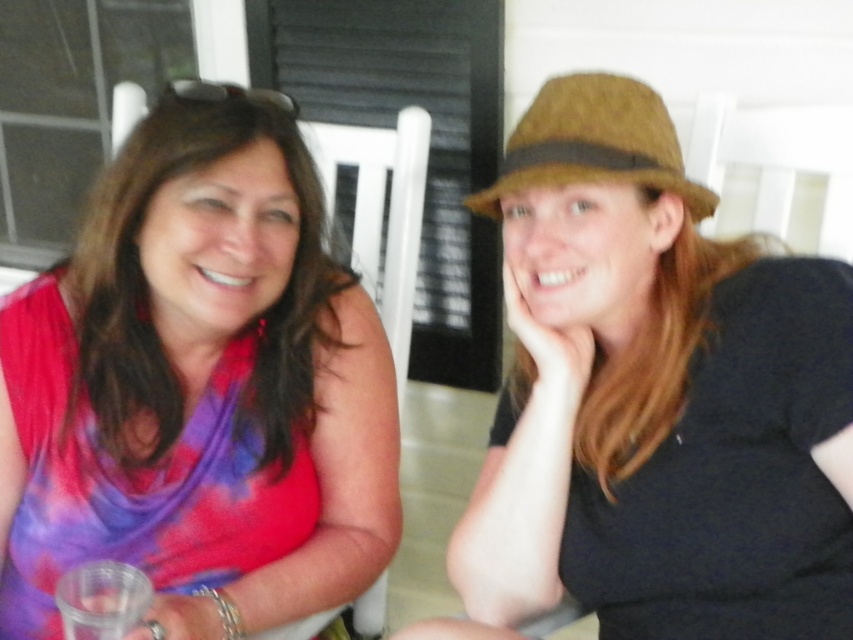
Question: Does matte tie-dye tank top at left have a lesser width compared to brown felt fedora at upper right?

Choices:
 (A) no
 (B) yes

Answer: (A)

Question: Does brown felt hat at upper right appear under brown felt fedora at upper right?

Choices:
 (A) yes
 (B) no

Answer: (A)

Question: Which is farther from the brown felt fedora at upper right?

Choices:
 (A) matte tie-dye tank top at left
 (B) brown felt hat at upper right

Answer: (A)

Question: Which of these objects is positioned farthest from the matte tie-dye tank top at left?

Choices:
 (A) brown felt fedora at upper right
 (B) brown felt hat at upper right

Answer: (A)

Question: Which is nearer to the brown felt hat at upper right?

Choices:
 (A) matte tie-dye tank top at left
 (B) brown felt fedora at upper right

Answer: (B)

Question: Can you confirm if brown felt hat at upper right is thinner than brown felt fedora at upper right?

Choices:
 (A) yes
 (B) no

Answer: (B)